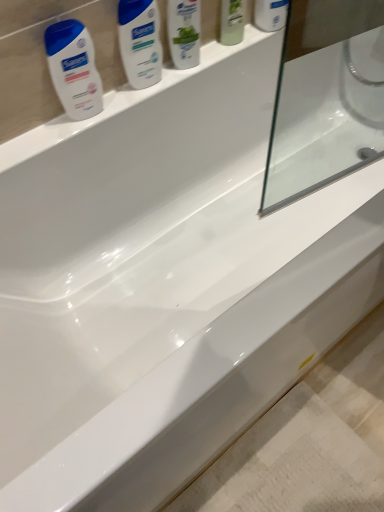
Find the location of a particular element. The width and height of the screenshot is (384, 512). vacant area that lies to the right of white glossy shampoo at upper center, which is the second cleaning product from left to right is located at coordinates (230, 53).